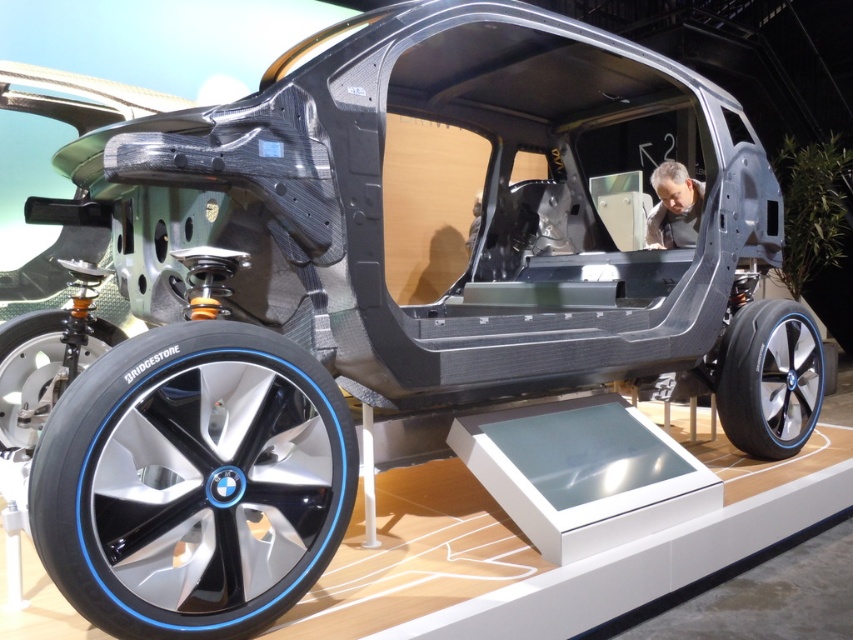
You are a mechanic who needs to replace the tires on both the polished aluminum wheel at lower left and the shiny metallic wheel at lower right. Which wheel requires a smaller tire size?

The polished aluminum wheel at lower left requires a smaller tire size because it is smaller than the shiny metallic wheel at lower right.

You are an engineer inspecting the futuristic vehicle. You need to place a 1.5 meter long measuring tape between the polished aluminum wheel at lower left and another object. Is there enough space to fully extend the measuring tape between them?

The distance between the polished aluminum wheel at lower left and the other object is 1.26 meters, so the 1.5 meter measuring tape cannot be fully extended between them as the space is shorter than the tape.

You are an auto show attendee standing in front of the futuristic concept car. You notice two wheels on the car, the polished aluminum wheel at lower left and the shiny metallic wheel at lower right. Which wheel is positioned more to the left side of the car?

The polished aluminum wheel at lower left is positioned more to the left side of the car than the shiny metallic wheel at lower right.